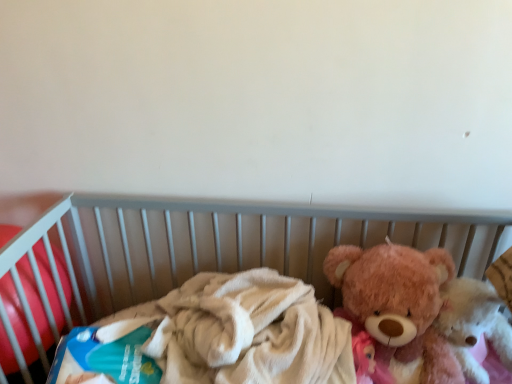
Question: Does point (138, 208) appear closer or farther from the camera than point (389, 312)?

Choices:
 (A) farther
 (B) closer

Answer: (A)

Question: From the image's perspective, relative to fluffy pink teddy bear at right, the 1th teddy bear when ordered from left to right, is soft plush bear at right above or below?

Choices:
 (A) above
 (B) below

Answer: (B)

Question: Considering the real-world distances, which object is farthest from the blue cardboard box at left?

Choices:
 (A) fluffy pink teddy bear at right, which is counted as the first teddy bear, starting from the right
 (B) fluffy pink teddy bear at right, the 1th teddy bear when ordered from left to right
 (C) soft plush bear at right

Answer: (A)

Question: Which is farther from the fluffy pink teddy bear at right, which is counted as the first teddy bear, starting from the right?

Choices:
 (A) soft plush bear at right
 (B) fluffy pink teddy bear at right, the 1th teddy bear when ordered from left to right
 (C) blue cardboard box at left

Answer: (C)